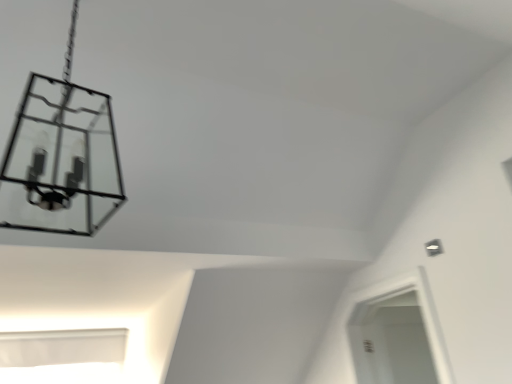
Measure the distance between clear glass chandelier at upper left and camera.

The distance of clear glass chandelier at upper left from camera is 38.19 inches.

Where is `clear glass chandelier at upper left`? clear glass chandelier at upper left is located at coordinates (61, 157).

What do you see at coordinates (61, 157) in the screenshot? The width and height of the screenshot is (512, 384). I see `clear glass chandelier at upper left` at bounding box center [61, 157].

You are a GUI agent. You are given a task and a screenshot of the screen. Output one action in this format:
    pyautogui.click(x=<x>, y=<y>)
    Task: Click on the clear glass chandelier at upper left
    
    Given the screenshot: What is the action you would take?
    pyautogui.click(x=61, y=157)